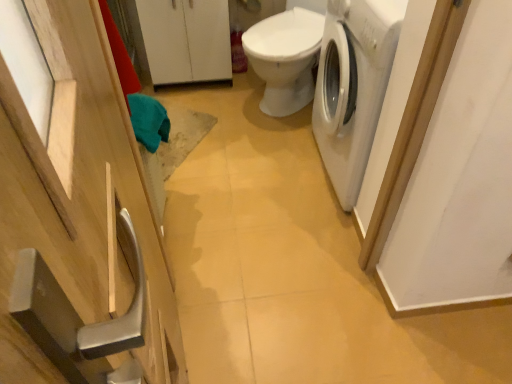
Question: Can you confirm if natural wood cabinet at left, marked as the second cabinetry in a back-to-front arrangement, is positioned to the right of white matte washing machine at right?

Choices:
 (A) yes
 (B) no

Answer: (B)

Question: Can you confirm if natural wood cabinet at left, marked as the second cabinetry in a back-to-front arrangement, is bigger than white matte washing machine at right?

Choices:
 (A) yes
 (B) no

Answer: (B)

Question: Can you confirm if natural wood cabinet at left, marked as the second cabinetry in a back-to-front arrangement, is smaller than white matte washing machine at right?

Choices:
 (A) no
 (B) yes

Answer: (B)

Question: Is natural wood cabinet at left, the 1th cabinetry in the bottom-to-top sequence, to the left of white matte washing machine at right from the viewer's perspective?

Choices:
 (A) yes
 (B) no

Answer: (A)

Question: Is natural wood cabinet at left, the 2th cabinetry positioned from the top, further to the viewer compared to white matte washing machine at right?

Choices:
 (A) yes
 (B) no

Answer: (B)

Question: From a real-world perspective, is natural wood cabinet at left, the 1th cabinetry in the bottom-to-top sequence, physically above white matte washing machine at right?

Choices:
 (A) yes
 (B) no

Answer: (A)

Question: Does white glossy toilet at center have a lesser width compared to white matte washing machine at right?

Choices:
 (A) no
 (B) yes

Answer: (A)

Question: Considering the relative sizes of white glossy toilet at center and white matte washing machine at right in the image provided, is white glossy toilet at center shorter than white matte washing machine at right?

Choices:
 (A) no
 (B) yes

Answer: (B)

Question: Is white glossy toilet at center positioned with its back to white matte washing machine at right?

Choices:
 (A) yes
 (B) no

Answer: (B)

Question: From the image's perspective, would you say white glossy toilet at center is shown under white matte washing machine at right?

Choices:
 (A) yes
 (B) no

Answer: (B)

Question: From a real-world perspective, is white glossy toilet at center under white matte washing machine at right?

Choices:
 (A) no
 (B) yes

Answer: (B)

Question: Are white glossy toilet at center and white matte washing machine at right beside each other?

Choices:
 (A) yes
 (B) no

Answer: (B)

Question: Is white matte washing machine at right facing away from white matte cabinet at upper center, arranged as the first cabinetry when viewed from the back?

Choices:
 (A) yes
 (B) no

Answer: (B)